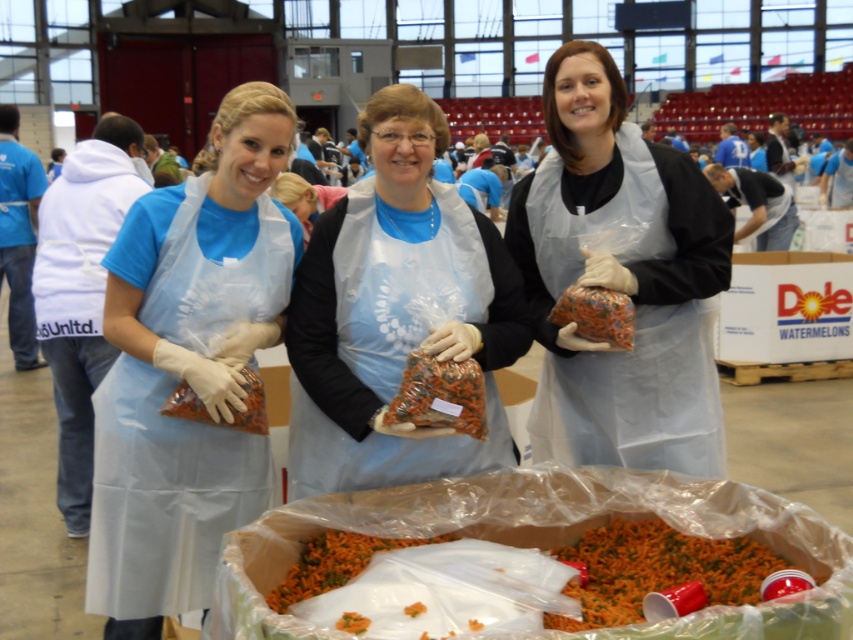
Is translucent plastic apron at center below orange shredded carrots at center?

No, translucent plastic apron at center is not below orange shredded carrots at center.

From the picture: Is translucent plastic apron at center smaller than orange shredded carrots at center?

No, translucent plastic apron at center is not smaller than orange shredded carrots at center.

Does point (440, 348) lie behind point (728, 577)?

Yes, it is behind point (728, 577).

The width and height of the screenshot is (853, 640). Find the location of `translucent plastic apron at center`. translucent plastic apron at center is located at coordinates (395, 312).

Who is more distant from viewer, (x=570, y=204) or (x=619, y=294)?

The point (x=570, y=204) is more distant.

Can you confirm if clear plastic apron at center is shorter than multicolored woven fabric bag at center?

No, clear plastic apron at center is not shorter than multicolored woven fabric bag at center.

Between point (561, 88) and point (630, 305), which one is positioned behind?

The point (561, 88) is more distant.

Locate an element on the screen. This screenshot has height=640, width=853. clear plastic apron at center is located at coordinates (619, 280).

You are a GUI agent. You are given a task and a screenshot of the screen. Output one action in this format:
    pyautogui.click(x=<x>, y=<y>)
    Task: Click on the clear plastic apron at center
    
    Given the screenshot: What is the action you would take?
    pyautogui.click(x=619, y=280)

The width and height of the screenshot is (853, 640). Describe the element at coordinates (619, 280) in the screenshot. I see `clear plastic apron at center` at that location.

Between point (645, 300) and point (190, 396), which one is positioned in front?

Positioned in front is point (190, 396).

Where is `clear plastic apron at center`? This screenshot has width=853, height=640. clear plastic apron at center is located at coordinates (619, 280).